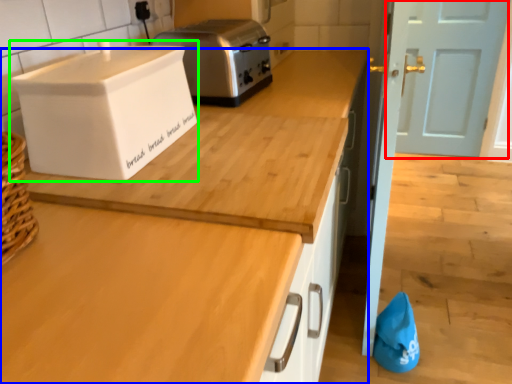
Question: Which object is the closest to the door (highlighted by a red box)? Choose among these: countertop (highlighted by a blue box) or home appliance (highlighted by a green box).

Choices:
 (A) countertop
 (B) home appliance

Answer: (A)